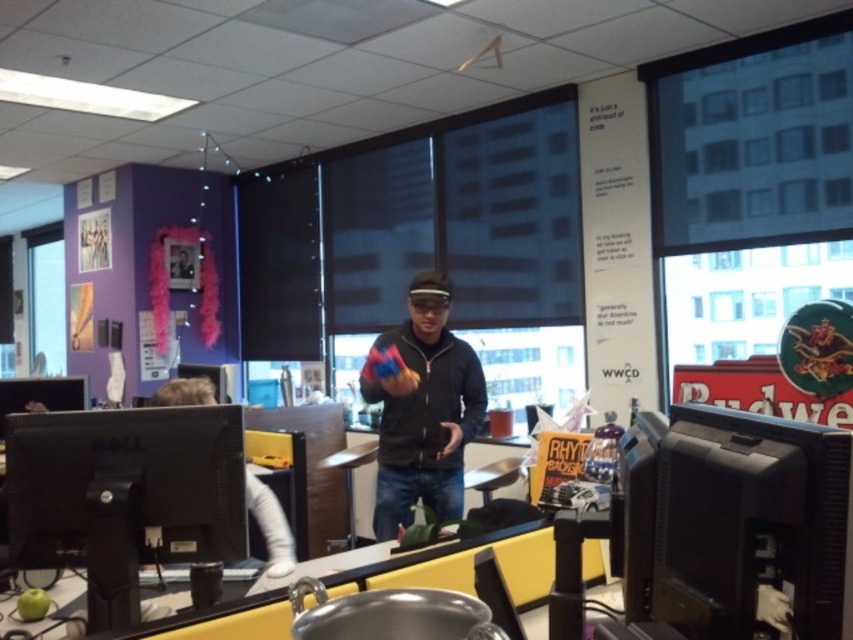
You are setting up a new monitor stand that can only hold monitors with a maximum width of 18 inches. You have two monitors available in the office scene described. Which monitor between the black matte monitor at right and the white matte monitor at left should you choose to ensure it fits on the stand?

The black matte monitor at right has a smaller size compared to the white matte monitor at left, so the black matte monitor at right is more likely to fit on the stand with the 18 inches width limit.

You are standing in the office and want to determine which of the two points, point (x=836, y=573) or point (x=271, y=493), is nearer to you. Based on the scene description, which point is closer?

Point (x=836, y=573) is closer to the viewer than point (x=271, y=493).